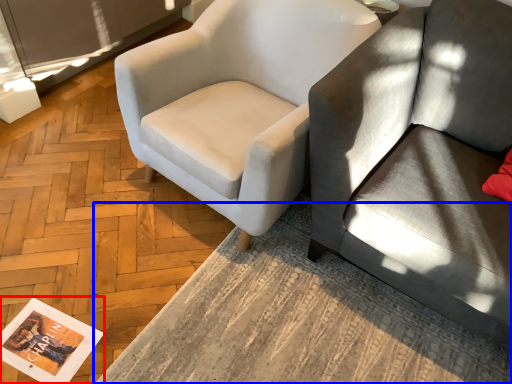
Question: Which object is further to the camera taking this photo, magazine (highlighted by a red box) or table (highlighted by a blue box)?

Choices:
 (A) magazine
 (B) table

Answer: (A)